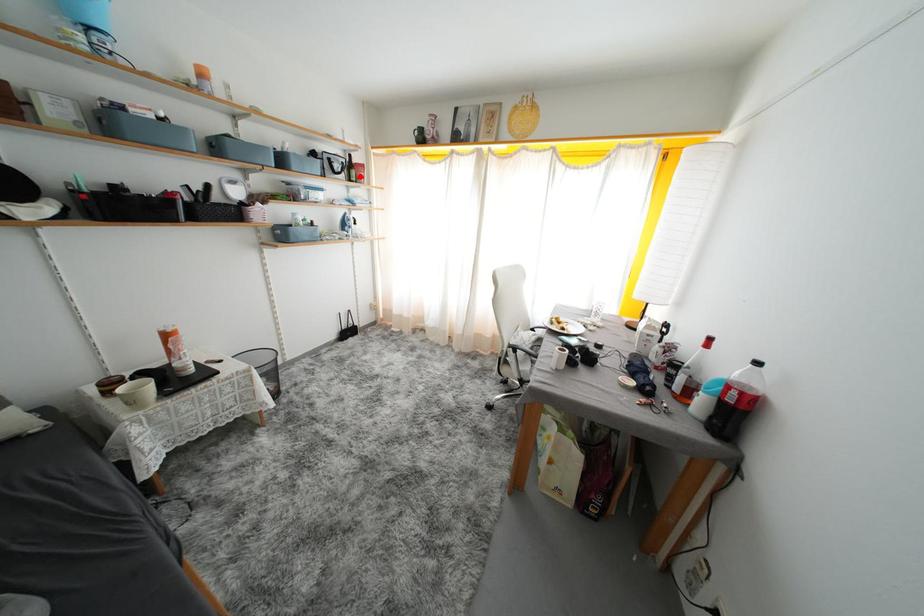
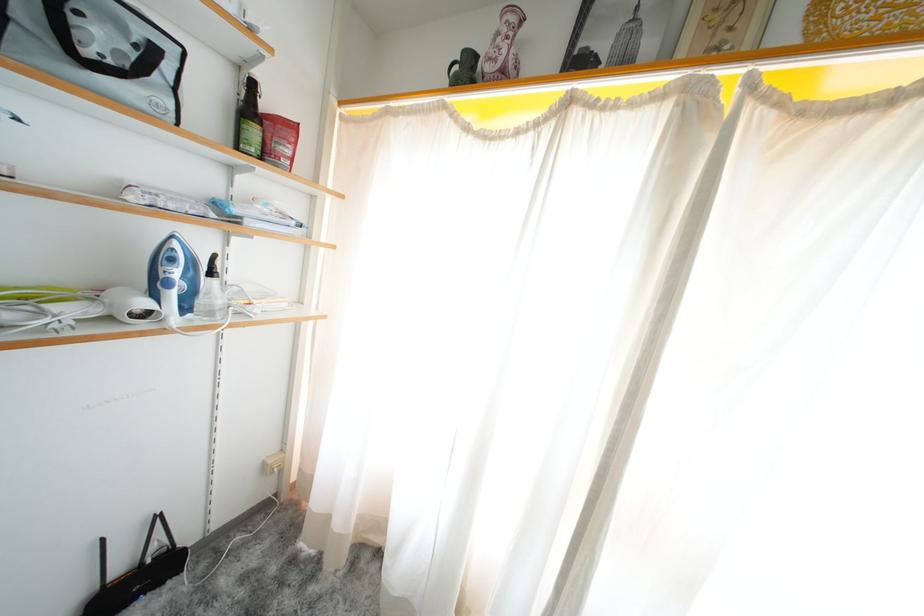
The point at the highlighted location is marked in the first image. Where is the corresponding point in the second image?

(261, 137)